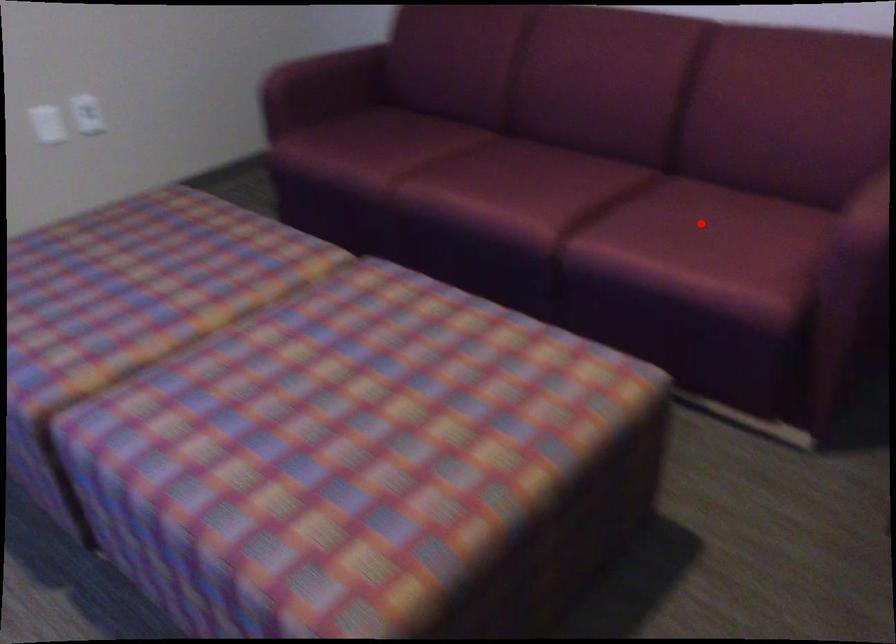
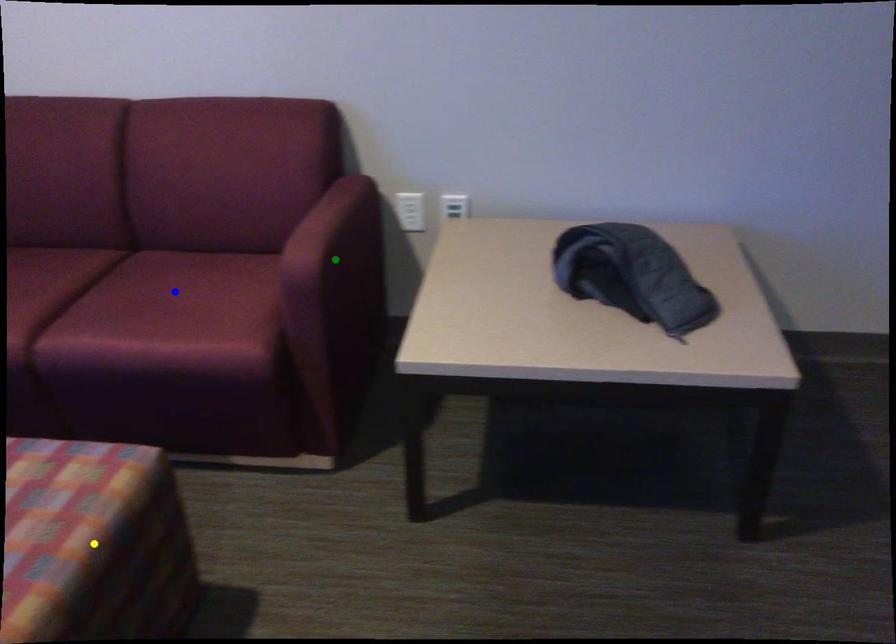
Question: I am providing you with two images of the same scene from different viewpoints. A red point is marked on the first image. You are given multiple points on the second image. Which spot in image 2 lines up with the point in image 1?

Choices:
 (A) yellow point
 (B) blue point
 (C) green point

Answer: (B)